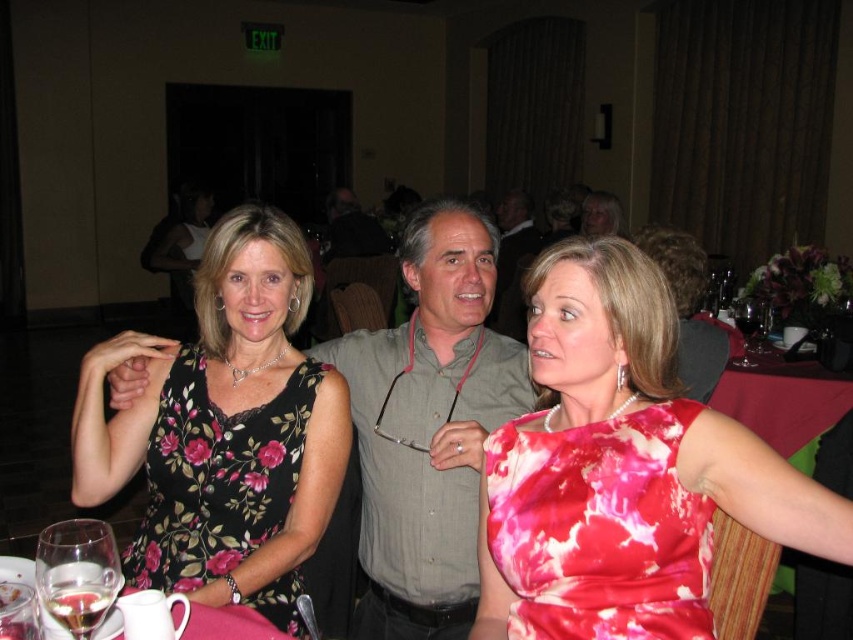
Is gray striped shirt at center to the left of pink fabric table at lower left from the viewer's perspective?

In fact, gray striped shirt at center is to the right of pink fabric table at lower left.

Can you confirm if gray striped shirt at center is positioned to the right of pink fabric table at lower left?

Indeed, gray striped shirt at center is positioned on the right side of pink fabric table at lower left.

Describe the element at coordinates (428, 426) in the screenshot. The image size is (853, 640). I see `gray striped shirt at center` at that location.

Find the location of a particular element. gray striped shirt at center is located at coordinates (428, 426).

Who is positioned more to the right, floral-patterned fabric dress at center or pink fabric table at lower left?

floral-patterned fabric dress at center

Is point (260, 536) behind point (210, 625)?

Yes, it is behind point (210, 625).

Locate an element on the screen. The height and width of the screenshot is (640, 853). floral-patterned fabric dress at center is located at coordinates (218, 476).

Does point (633, 493) lie in front of point (693, 417)?

Yes, it is in front of point (693, 417).

Who is positioned more to the right, matte pink dress at center or shiny pink dress at center?

matte pink dress at center is more to the right.

Where is `matte pink dress at center`? matte pink dress at center is located at coordinates (622, 467).

I want to click on matte pink dress at center, so click(x=622, y=467).